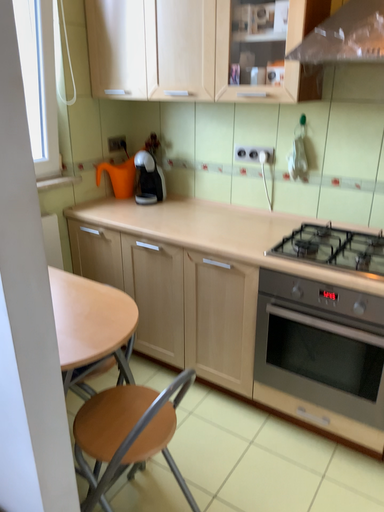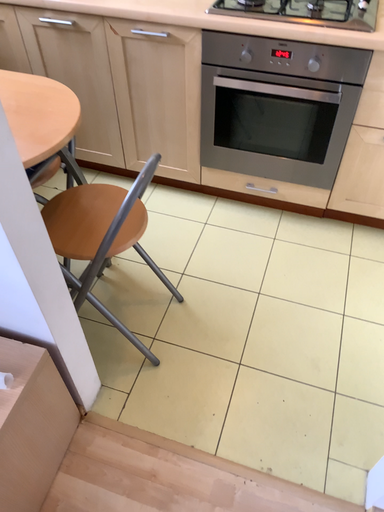
Question: Which way did the camera rotate in the video?

Choices:
 (A) rotated left
 (B) rotated right

Answer: (B)